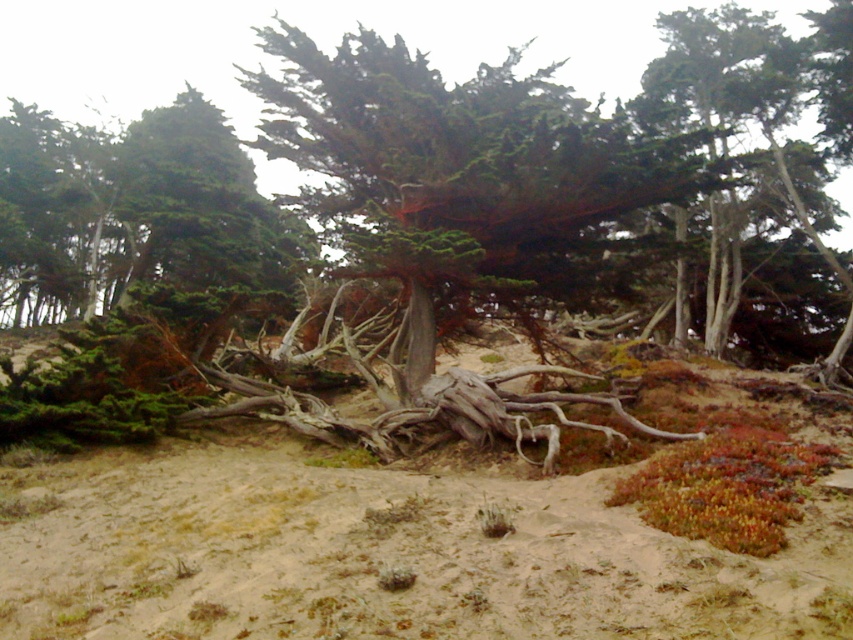
Question: Estimate the real-world distances between objects in this image. Which object is farther from the grayish-brown wood at center?

Choices:
 (A) green textured cypress tree at center
 (B) brown textured sand at center

Answer: (A)

Question: Which of these objects is positioned closest to the grayish-brown wood at center?

Choices:
 (A) green textured cypress tree at center
 (B) brown textured sand at center

Answer: (B)

Question: Does green textured cypress tree at center have a smaller size compared to grayish-brown wood at center?

Choices:
 (A) no
 (B) yes

Answer: (A)

Question: Is brown textured sand at center wider than green textured cypress tree at center?

Choices:
 (A) no
 (B) yes

Answer: (A)

Question: Can you confirm if brown textured sand at center is thinner than green textured cypress tree at center?

Choices:
 (A) no
 (B) yes

Answer: (B)

Question: Which is nearer to the brown textured sand at center?

Choices:
 (A) green textured cypress tree at center
 (B) grayish-brown wood at center

Answer: (B)